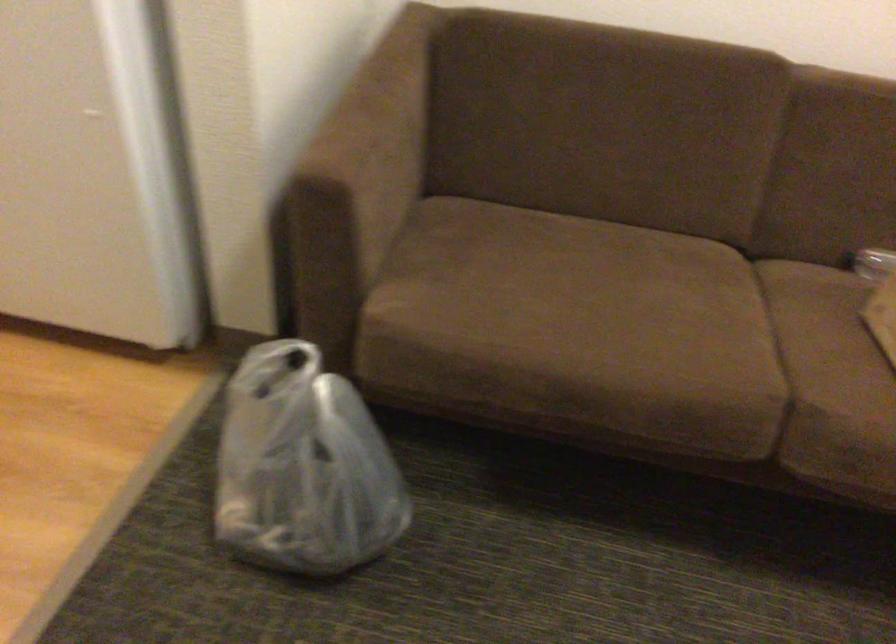
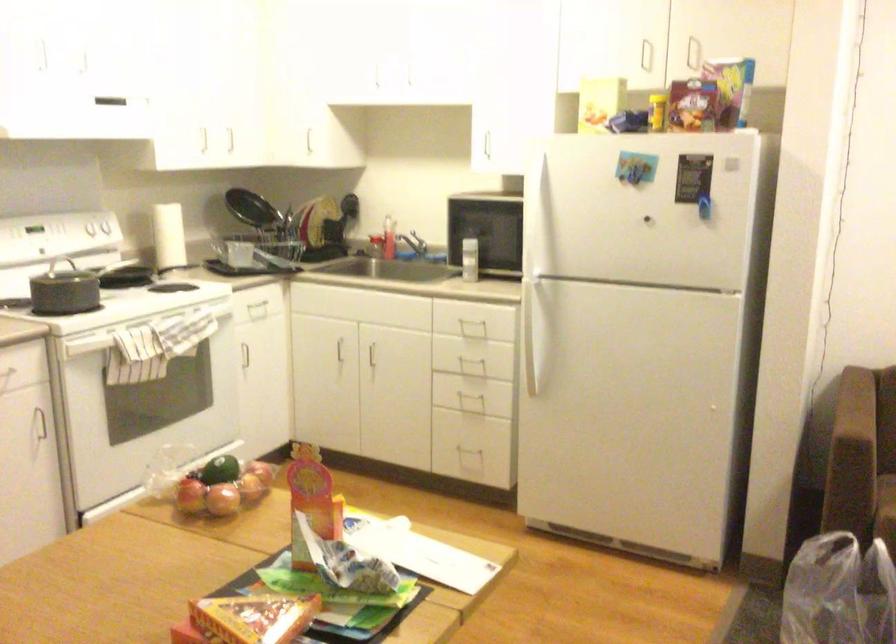
Where in the second image is the point corresponding to (323,299) from the first image?

(863, 513)